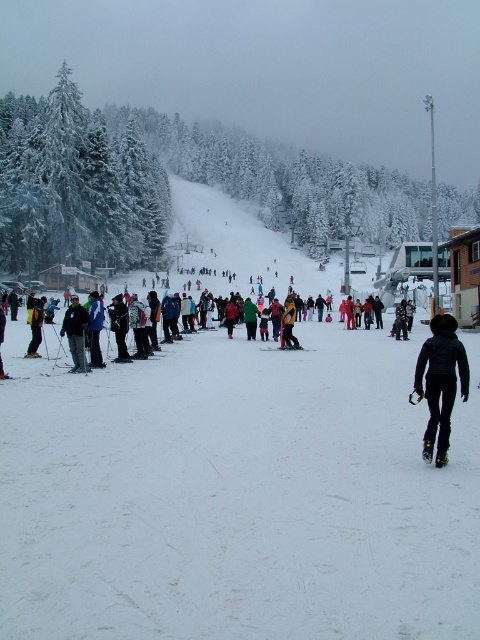
You are a photographer standing at the center of the ski resort scene. You want to take a photo that includes both the black matte snowboard at lower right and the matte black ski at lower left. Which object should you adjust your camera angle to focus on first to ensure both are in frame?

The black matte snowboard at lower right is closer to the viewer than the matte black ski at lower left. To ensure both are in frame, focus on the black matte snowboard at lower right first, as it is closer and requires adjusting the angle to include the farther matte black ski at lower left.

You are a photographer trying to capture a photo of the dark blue jacket at center and the black matte snowboard at lower right. From your current position, which object should you adjust your camera to focus on first if you want to include both in the frame without moving your position?

You should focus on the dark blue jacket at center first because the black matte snowboard at lower right is to the right of it, so adjusting from the center towards the right would ensure both are included in the frame.

You are a photographer standing in the middle of the ski resort scene. You want to capture a photo that includes both the black matte snowboard at lower right and the matte black ski at lower left. Given their distance apart, will you need to zoom out your camera lens to fit both objects into the frame?

The black matte snowboard at lower right and the matte black ski at lower left are 30.08 feet apart from each other. To capture both in the same frame, you would need to zoom out your camera lens to accommodate the distance between them.